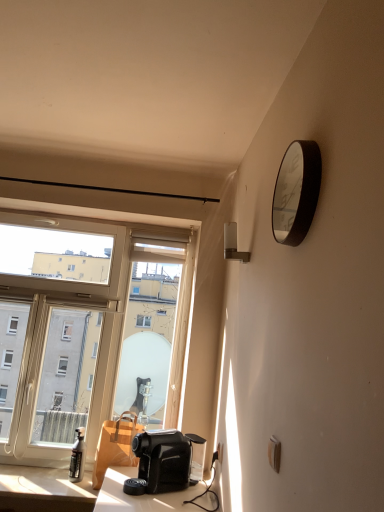
Question: Is metallic silver clock at upper right with transparent glass window at left?

Choices:
 (A) no
 (B) yes

Answer: (A)

Question: From a real-world perspective, is metallic silver clock at upper right below transparent glass window at left?

Choices:
 (A) yes
 (B) no

Answer: (B)

Question: Can you confirm if metallic silver clock at upper right is thinner than transparent glass window at left?

Choices:
 (A) no
 (B) yes

Answer: (B)

Question: Can you confirm if metallic silver clock at upper right is shorter than transparent glass window at left?

Choices:
 (A) yes
 (B) no

Answer: (A)

Question: Can you confirm if metallic silver clock at upper right is taller than transparent glass window at left?

Choices:
 (A) no
 (B) yes

Answer: (A)

Question: From the image's perspective, is white plastic lamp at upper right located above or below matte black spray bottle at lower left?

Choices:
 (A) below
 (B) above

Answer: (B)

Question: Is white plastic lamp at upper right to the left or to the right of matte black spray bottle at lower left in the image?

Choices:
 (A) left
 (B) right

Answer: (B)

Question: From a real-world perspective, is white plastic lamp at upper right physically located above or below matte black spray bottle at lower left?

Choices:
 (A) above
 (B) below

Answer: (A)

Question: Is white plastic lamp at upper right taller or shorter than matte black spray bottle at lower left?

Choices:
 (A) tall
 (B) short

Answer: (B)

Question: From a real-world perspective, is transparent glass window at left physically located above or below white plastic lamp at upper right?

Choices:
 (A) below
 (B) above

Answer: (A)

Question: Considering the positions of transparent glass window at left and white plastic lamp at upper right in the image, is transparent glass window at left wider or thinner than white plastic lamp at upper right?

Choices:
 (A) wide
 (B) thin

Answer: (B)

Question: In terms of height, does transparent glass window at left look taller or shorter compared to white plastic lamp at upper right?

Choices:
 (A) short
 (B) tall

Answer: (B)

Question: In terms of size, does transparent glass window at left appear bigger or smaller than white plastic lamp at upper right?

Choices:
 (A) big
 (B) small

Answer: (A)

Question: Is transparent glass window at left wider or thinner than matte black spray bottle at lower left?

Choices:
 (A) wide
 (B) thin

Answer: (B)

Question: Do you think transparent glass window at left is within matte black spray bottle at lower left, or outside of it?

Choices:
 (A) inside
 (B) outside

Answer: (B)